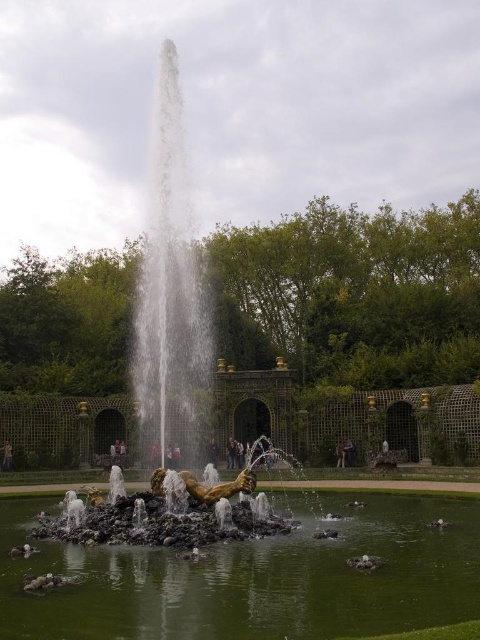
Question: Can you confirm if green polished stone water at center is bigger than gold metallic statue at center?

Choices:
 (A) yes
 (B) no

Answer: (B)

Question: Among these objects, which one is farthest from the camera?

Choices:
 (A) gold metallic statue at center
 (B) golden statue at center
 (C) green polished stone water at center

Answer: (B)

Question: Which is nearer to the golden statue at center?

Choices:
 (A) gold metallic statue at center
 (B) green polished stone water at center

Answer: (A)

Question: Can you confirm if gold metallic statue at center is thinner than golden statue at center?

Choices:
 (A) yes
 (B) no

Answer: (B)

Question: Can you confirm if green polished stone water at center is positioned to the left of golden statue at center?

Choices:
 (A) yes
 (B) no

Answer: (B)

Question: Among these points, which one is farthest from the camera?

Choices:
 (A) (7, 442)
 (B) (215, 540)
 (C) (459, 506)

Answer: (A)